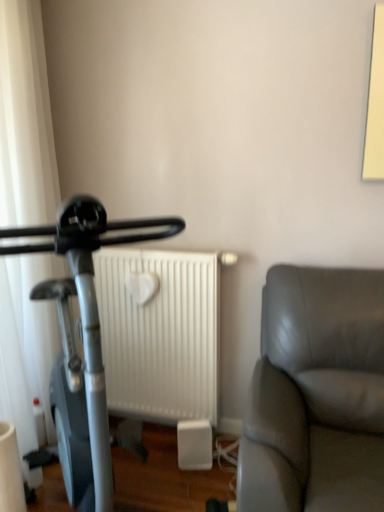
Question: Considering the relative positions of white matte radiator at center and silver metallic stationary bicycle at left in the image provided, is white matte radiator at center to the left of silver metallic stationary bicycle at left from the viewer's perspective?

Choices:
 (A) no
 (B) yes

Answer: (A)

Question: Does white matte radiator at center come behind silver metallic stationary bicycle at left?

Choices:
 (A) no
 (B) yes

Answer: (B)

Question: Does white matte radiator at center have a lesser height compared to silver metallic stationary bicycle at left?

Choices:
 (A) no
 (B) yes

Answer: (B)

Question: Does white matte radiator at center have a lesser width compared to silver metallic stationary bicycle at left?

Choices:
 (A) yes
 (B) no

Answer: (A)

Question: Could you tell me if white matte radiator at center is facing silver metallic stationary bicycle at left?

Choices:
 (A) no
 (B) yes

Answer: (B)

Question: Can you confirm if white matte radiator at center is taller than silver metallic stationary bicycle at left?

Choices:
 (A) yes
 (B) no

Answer: (B)

Question: Is white sheer curtain at left thinner than silver metallic stationary bicycle at left?

Choices:
 (A) yes
 (B) no

Answer: (A)

Question: Considering the relative positions of white sheer curtain at left and silver metallic stationary bicycle at left in the image provided, is white sheer curtain at left to the left of silver metallic stationary bicycle at left from the viewer's perspective?

Choices:
 (A) yes
 (B) no

Answer: (A)

Question: Does white sheer curtain at left have a greater height compared to silver metallic stationary bicycle at left?

Choices:
 (A) no
 (B) yes

Answer: (B)

Question: Considering the relative positions of white sheer curtain at left and silver metallic stationary bicycle at left in the image provided, is white sheer curtain at left behind silver metallic stationary bicycle at left?

Choices:
 (A) yes
 (B) no

Answer: (A)

Question: Does white sheer curtain at left contain silver metallic stationary bicycle at left?

Choices:
 (A) no
 (B) yes

Answer: (A)

Question: Does white sheer curtain at left touch silver metallic stationary bicycle at left?

Choices:
 (A) yes
 (B) no

Answer: (B)

Question: Are silver metallic stationary bicycle at left and white matte radiator at center beside each other?

Choices:
 (A) yes
 (B) no

Answer: (B)